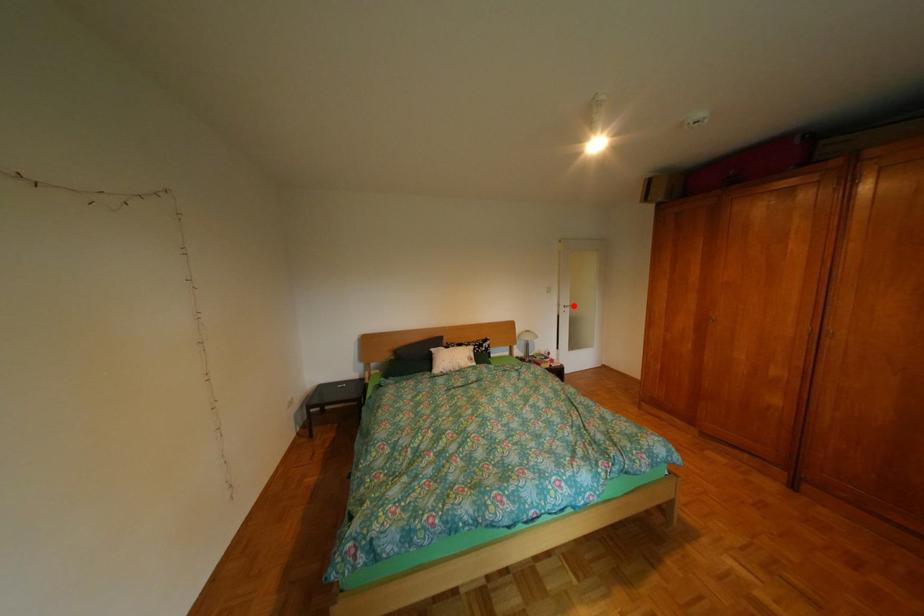
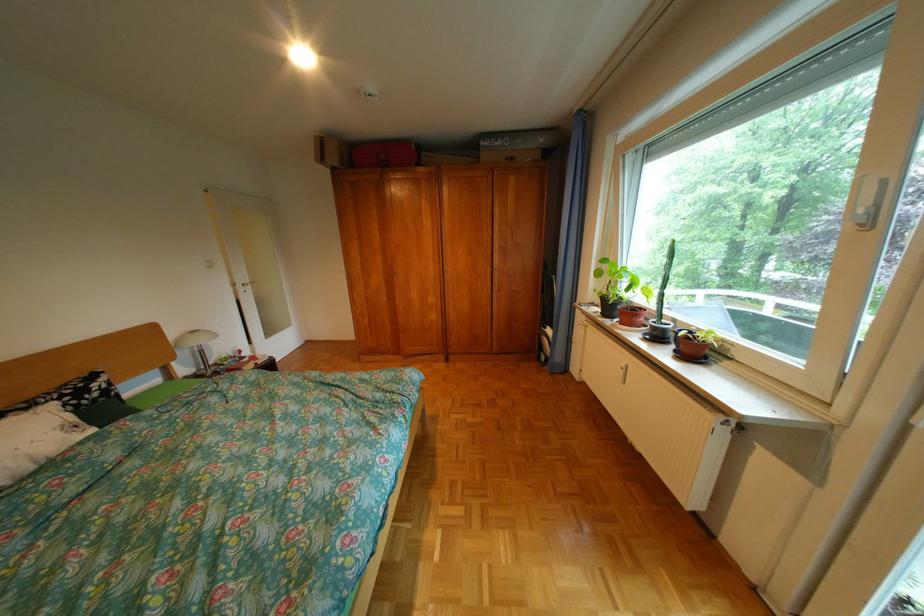
In the second image, find the point that corresponds to the highlighted location in the first image.

(248, 285)